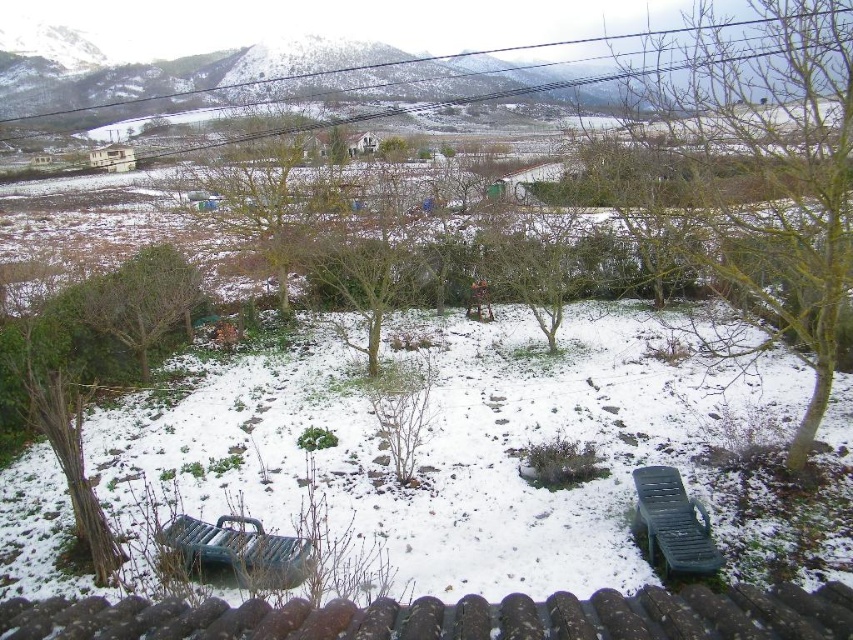
Who is positioned more to the right, bare wood tree at center or green plastic park bench at lower center?

Positioned to the right is bare wood tree at center.

Does bare wood tree at center have a greater height compared to green plastic park bench at lower center?

Correct, bare wood tree at center is much taller as green plastic park bench at lower center.

You are a GUI agent. You are given a task and a screenshot of the screen. Output one action in this format:
    pyautogui.click(x=<x>, y=<y>)
    Task: Click on the bare wood tree at center
    
    Given the screenshot: What is the action you would take?
    pyautogui.click(x=761, y=173)

Find the location of a particular element. The height and width of the screenshot is (640, 853). bare wood tree at center is located at coordinates (761, 173).

Which is above, bare wood tree at center or green leafy tree at left?

bare wood tree at center is higher up.

Where is `bare wood tree at center`? This screenshot has width=853, height=640. bare wood tree at center is located at coordinates (761, 173).

In order to click on bare wood tree at center in this screenshot , I will do `click(761, 173)`.

From the picture: Which is more to the right, green leafy tree at left or green plastic park bench at lower right?

green plastic park bench at lower right

Is green leafy tree at left above green plastic park bench at lower right?

Correct, green leafy tree at left is located above green plastic park bench at lower right.

What are the coordinates of `green leafy tree at left` in the screenshot? It's located at (138, 300).